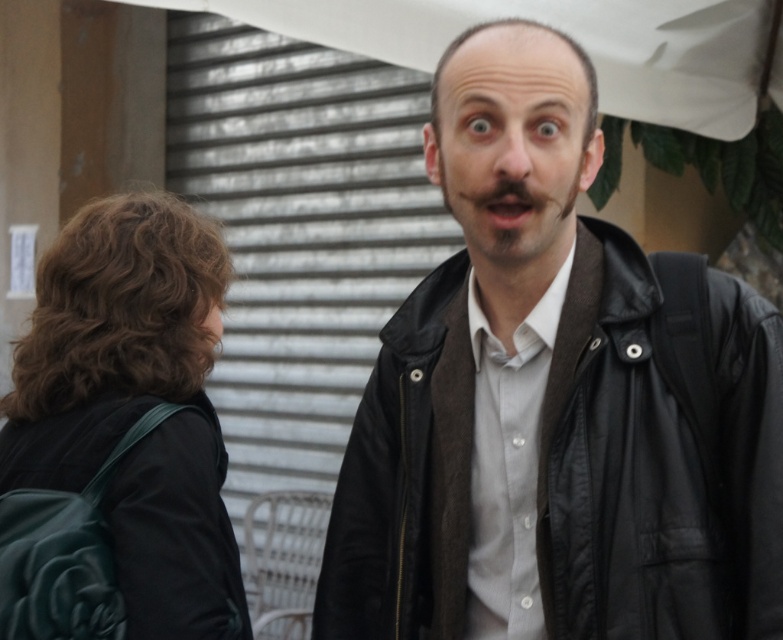
Question: Which point is farther to the camera?

Choices:
 (A) black leather jacket at center
 (B) brown fuzzy beard at center
 (C) dark brown hair at left

Answer: (C)

Question: Observing the image, what is the correct spatial positioning of black leather jacket at center in reference to brown fuzzy beard at center?

Choices:
 (A) right
 (B) left

Answer: (A)

Question: Among these points, which one is farthest from the camera?

Choices:
 (A) (399, 404)
 (B) (565, 214)
 (C) (175, 369)

Answer: (C)

Question: Is black leather jacket at center to the left of dark brown hair at left from the viewer's perspective?

Choices:
 (A) no
 (B) yes

Answer: (A)

Question: Can you confirm if black leather jacket at center is wider than brown fuzzy beard at center?

Choices:
 (A) no
 (B) yes

Answer: (B)

Question: Which of the following is the closest to the observer?

Choices:
 (A) dark brown hair at left
 (B) black leather jacket at center
 (C) brown fuzzy beard at center

Answer: (B)